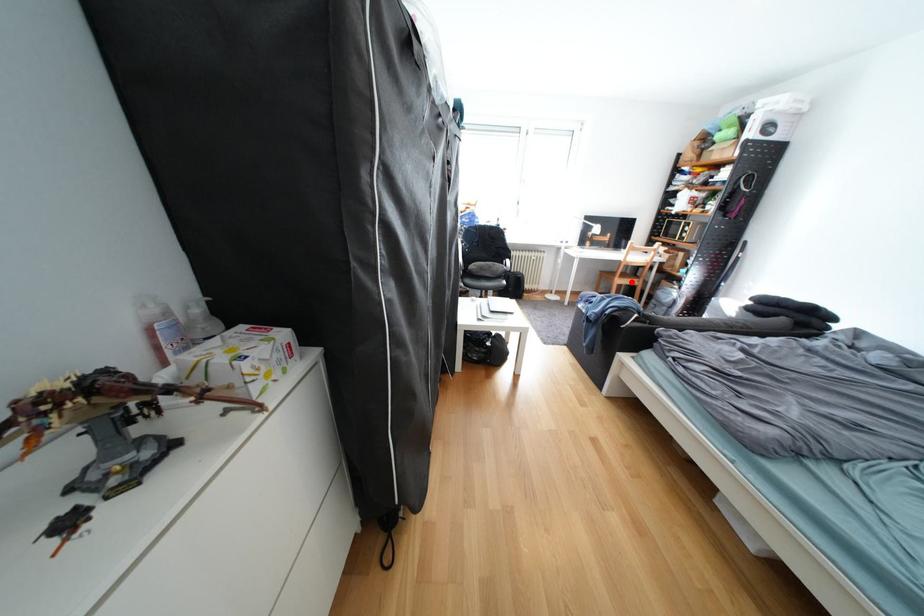
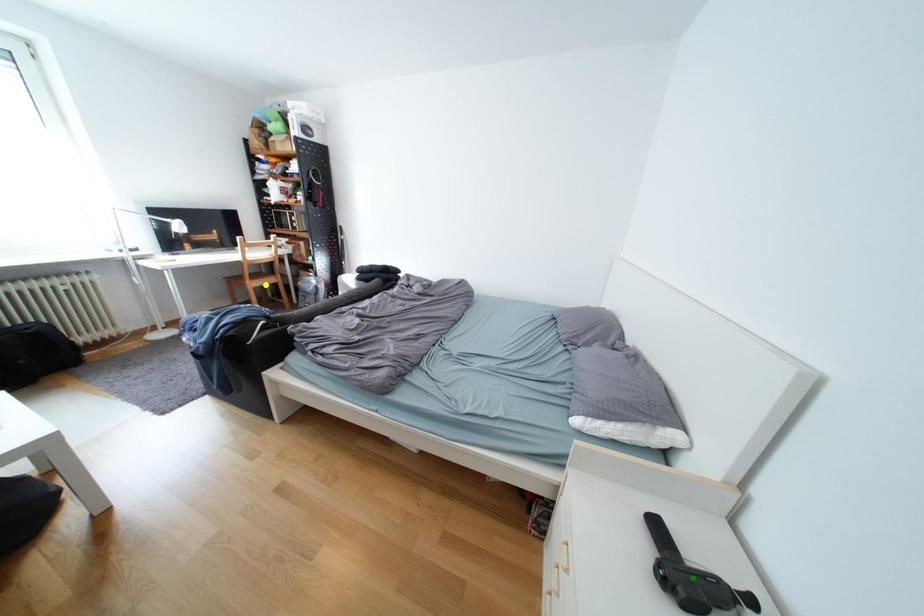
Question: I am providing you with two images of the same scene from different viewpoints. A red point is marked on the first image. You are given multiple points on the second image. Which point in image 2 represents the same 3d spot as the red point in image 1?

Choices:
 (A) blue point
 (B) green point
 (C) yellow point

Answer: (C)